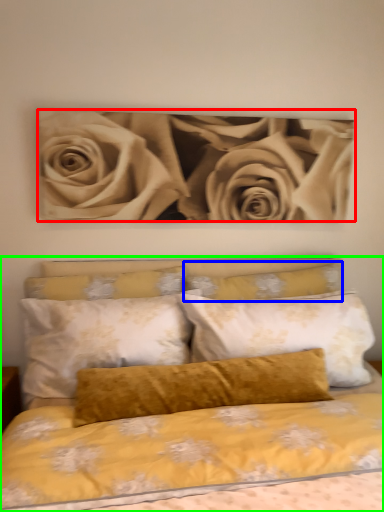
Question: Which is farther away from rose (highlighted by a red box)? pillow (highlighted by a blue box) or bed (highlighted by a green box)?

Choices:
 (A) pillow
 (B) bed

Answer: (B)